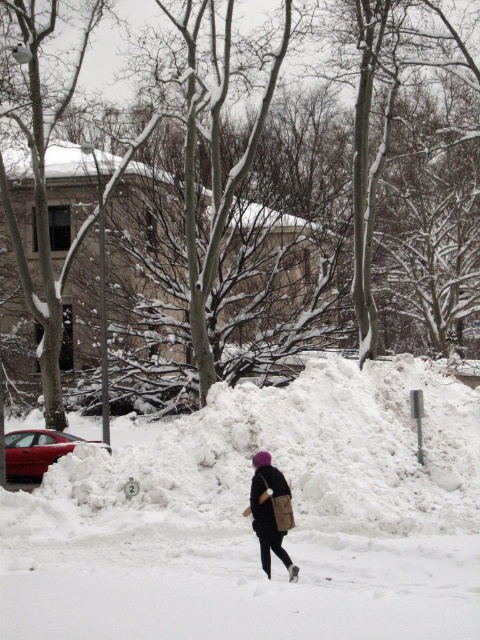
Question: Does white fluffy snow at center appear over dark brown leather jacket at center?

Choices:
 (A) yes
 (B) no

Answer: (A)

Question: Is white fluffy snow at center positioned in front of dark brown leather jacket at center?

Choices:
 (A) yes
 (B) no

Answer: (A)

Question: In this image, where is white fluffy snow at center located relative to dark brown leather jacket at center?

Choices:
 (A) right
 (B) left

Answer: (B)